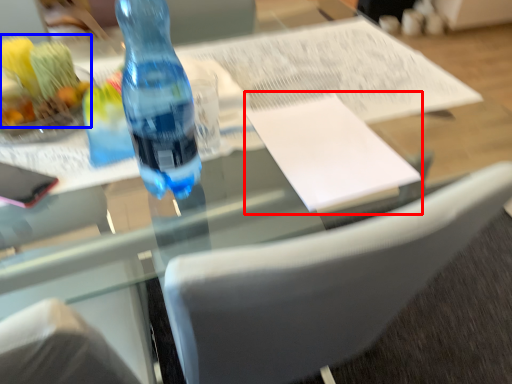
Question: Which object appears closest to the camera in this image, journal (highlighted by a red box) or food (highlighted by a blue box)?

Choices:
 (A) journal
 (B) food

Answer: (B)